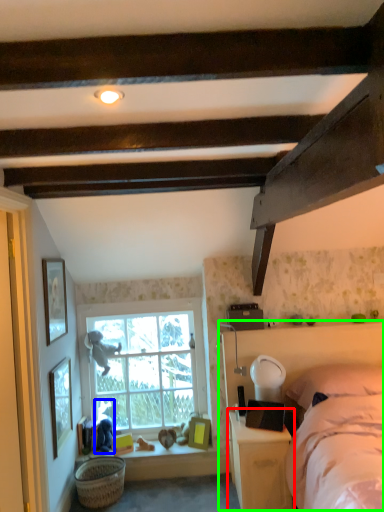
Question: Which object is positioned farthest from nightstand (highlighted by a red box)? Select from person (highlighted by a blue box) and bed frame (highlighted by a green box).

Choices:
 (A) person
 (B) bed frame

Answer: (A)